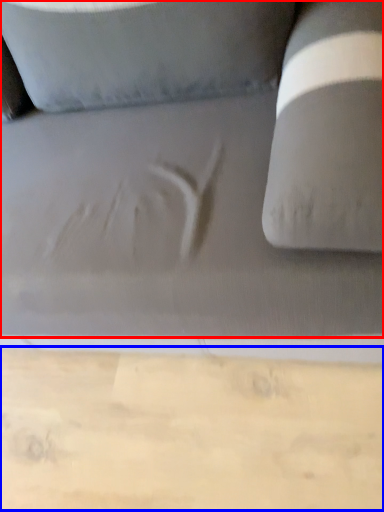
Question: Which object is closer to the camera taking this photo, studio couch (highlighted by a red box) or cardboard (highlighted by a blue box)?

Choices:
 (A) studio couch
 (B) cardboard

Answer: (A)